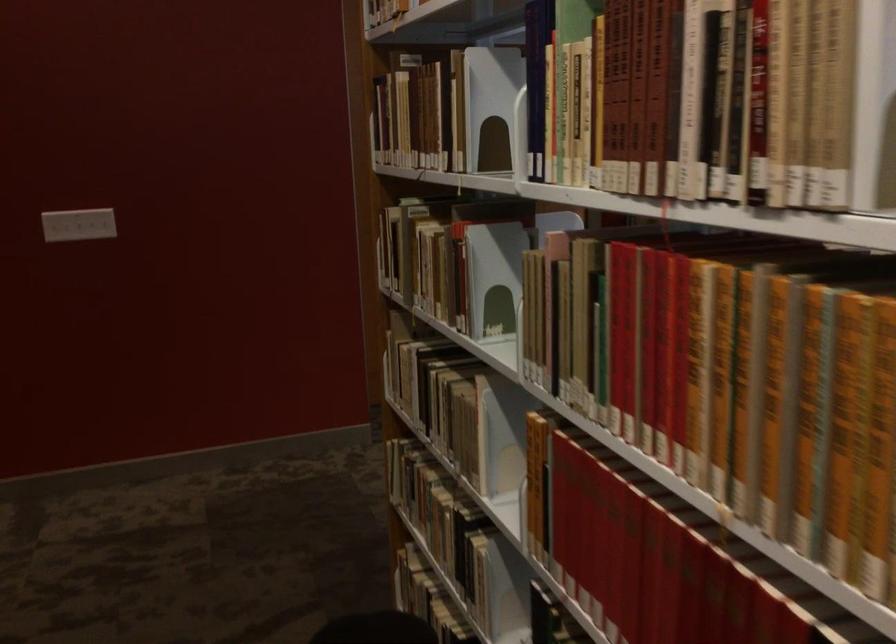
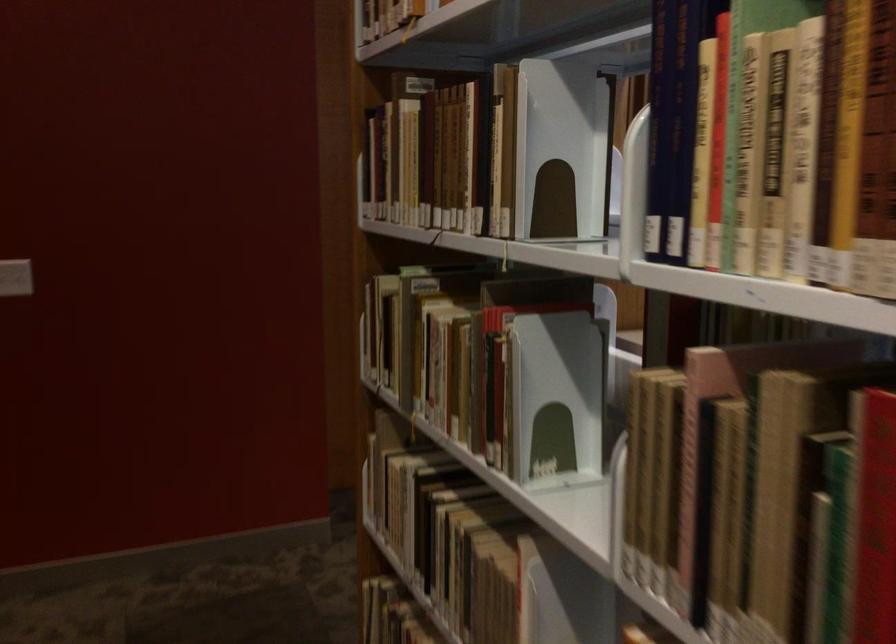
The point at [411,114] is marked in the first image. Where is the corresponding point in the second image?

(425, 158)